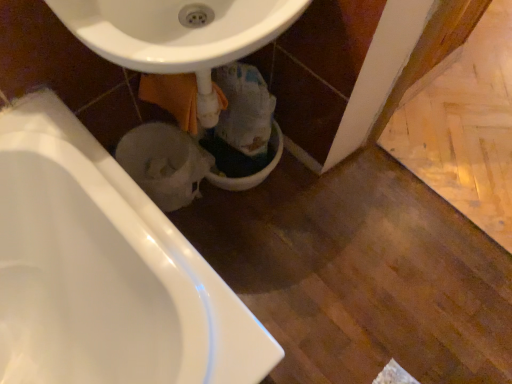
What do you see at coordinates (117, 260) in the screenshot? The image size is (512, 384). I see `white glossy bathtub at lower left` at bounding box center [117, 260].

The width and height of the screenshot is (512, 384). Identify the location of white glossy toilet bowl at center, the 2th toilet bowl viewed from the left. (253, 174).

In order to face white glossy toilet bowl at lower center, the first toilet bowl from the left, should I rotate leftwards or rightwards?

You should look left and rotate roughly 11.383 degrees.

Where is `white glossy bathtub at lower left`? The image size is (512, 384). white glossy bathtub at lower left is located at coordinates (117, 260).

Consider the image. Is white glossy bathtub at lower left not within white glossy sink at center?

Indeed, white glossy bathtub at lower left is completely outside white glossy sink at center.

Can you see white glossy bathtub at lower left touching white glossy sink at center?

There is a gap between white glossy bathtub at lower left and white glossy sink at center.

Is white glossy bathtub at lower left taller or shorter than white glossy sink at center?

white glossy bathtub at lower left is taller than white glossy sink at center.

Which is behind, point (84, 228) or point (179, 58)?

The point (84, 228) is behind.

From a real-world perspective, which object stands above the other?

white glossy sink at center is physically above.

Is white glossy sink at center positioned beyond the bounds of white glossy toilet bowl at lower center, the 2th toilet bowl from the right?

white glossy sink at center is positioned outside white glossy toilet bowl at lower center, the 2th toilet bowl from the right.

In terms of height, does white glossy sink at center look taller or shorter compared to white glossy toilet bowl at lower center, the 2th toilet bowl from the right?

Clearly, white glossy sink at center is taller compared to white glossy toilet bowl at lower center, the 2th toilet bowl from the right.

Considering the sizes of objects white glossy bathtub at lower left and white glossy toilet bowl at lower center, the 2th toilet bowl from the right, in the image provided, who is shorter, white glossy bathtub at lower left or white glossy toilet bowl at lower center, the 2th toilet bowl from the right,?

Standing shorter between the two is white glossy toilet bowl at lower center, the 2th toilet bowl from the right.

Would you consider white glossy bathtub at lower left to be distant from white glossy toilet bowl at lower center, the 2th toilet bowl from the right?

No, white glossy bathtub at lower left is not far from white glossy toilet bowl at lower center, the 2th toilet bowl from the right.

Which is more to the right, white glossy bathtub at lower left or white glossy toilet bowl at lower center, the first toilet bowl from the left?

From the viewer's perspective, white glossy toilet bowl at lower center, the first toilet bowl from the left, appears more on the right side.

Is white glossy bathtub at lower left situated inside white glossy toilet bowl at lower center, the 2th toilet bowl from the right, or outside?

white glossy bathtub at lower left is outside white glossy toilet bowl at lower center, the 2th toilet bowl from the right.

In terms of size, does white glossy toilet bowl at center, the 2th toilet bowl viewed from the left, appear bigger or smaller than white glossy bathtub at lower left?

Clearly, white glossy toilet bowl at center, the 2th toilet bowl viewed from the left, is smaller in size than white glossy bathtub at lower left.

Is white glossy toilet bowl at center, the 2th toilet bowl viewed from the left, wider or thinner than white glossy bathtub at lower left?

Considering their sizes, white glossy toilet bowl at center, the 2th toilet bowl viewed from the left, looks slimmer than white glossy bathtub at lower left.

Is white glossy toilet bowl at center, the 1th toilet bowl in the right-to-left sequence, facing away from white glossy bathtub at lower left?

No, white glossy bathtub at lower left is not at the back of white glossy toilet bowl at center, the 1th toilet bowl in the right-to-left sequence.

Is white glossy toilet bowl at center, the 1th toilet bowl in the right-to-left sequence, placed right next to white glossy bathtub at lower left?

No.

Which object is closer to the camera, white glossy toilet bowl at center, the 2th toilet bowl viewed from the left, or white glossy toilet bowl at lower center, the 2th toilet bowl from the right?

white glossy toilet bowl at lower center, the 2th toilet bowl from the right, is more forward.

I want to click on toilet bowl located in front of the white glossy toilet bowl at center, the 1th toilet bowl in the right-to-left sequence, so click(x=164, y=163).

Between point (207, 174) and point (144, 127), which one is positioned in front?

The point (144, 127) is in front.

From the image's perspective, is white glossy toilet bowl at center, the 1th toilet bowl in the right-to-left sequence, under white glossy toilet bowl at lower center, the 2th toilet bowl from the right?

No, from the image's perspective, white glossy toilet bowl at center, the 1th toilet bowl in the right-to-left sequence, is not below white glossy toilet bowl at lower center, the 2th toilet bowl from the right.

Which is more to the left, white glossy sink at center or white glossy toilet bowl at center, the 1th toilet bowl in the right-to-left sequence?

Positioned to the left is white glossy sink at center.

Does white glossy sink at center turn towards white glossy toilet bowl at center, the 1th toilet bowl in the right-to-left sequence?

No, white glossy sink at center is not turned towards white glossy toilet bowl at center, the 1th toilet bowl in the right-to-left sequence.

From the image's perspective, is white glossy sink at center above white glossy toilet bowl at center, the 1th toilet bowl in the right-to-left sequence?

Yes, from the image's perspective, white glossy sink at center is above white glossy toilet bowl at center, the 1th toilet bowl in the right-to-left sequence.

Visually, is white glossy sink at center positioned to the left or to the right of white glossy bathtub at lower left?

Clearly, white glossy sink at center is on the right of white glossy bathtub at lower left in the image.

Find the location of a particular element. The height and width of the screenshot is (384, 512). sink above the white glossy bathtub at lower left (from a real-world perspective) is located at coordinates (178, 35).

Is white glossy sink at center further to camera compared to white glossy bathtub at lower left?

Yes, it is.

Is white glossy sink at center turned away from white glossy bathtub at lower left?

No, white glossy sink at center's orientation is not away from white glossy bathtub at lower left.

Where is `sink above the white glossy bathtub at lower left (from the image's perspective)`? The height and width of the screenshot is (384, 512). sink above the white glossy bathtub at lower left (from the image's perspective) is located at coordinates (178, 35).

At what (x,y) coordinates should I click in order to perform the action: click on sink located in front of the white glossy toilet bowl at lower center, the first toilet bowl from the left. Please return your answer as a coordinate pair (x, y). The height and width of the screenshot is (384, 512). Looking at the image, I should click on (178, 35).

Based on their spatial positions, is white glossy bathtub at lower left or white glossy toilet bowl at center, the 1th toilet bowl in the right-to-left sequence, further from white glossy sink at center?

Based on the image, white glossy toilet bowl at center, the 1th toilet bowl in the right-to-left sequence, appears to be further to white glossy sink at center.

Based on the photo, based on their spatial positions, is white glossy toilet bowl at center, the 1th toilet bowl in the right-to-left sequence, or white glossy bathtub at lower left closer to white glossy toilet bowl at lower center, the first toilet bowl from the left?

The object closer to white glossy toilet bowl at lower center, the first toilet bowl from the left, is white glossy toilet bowl at center, the 1th toilet bowl in the right-to-left sequence.

Based on their spatial positions, is white glossy bathtub at lower left or white glossy sink at center further from white glossy toilet bowl at lower center, the 2th toilet bowl from the right?

Among the two, white glossy bathtub at lower left is located further to white glossy toilet bowl at lower center, the 2th toilet bowl from the right.

From the image, which object appears to be farther from white glossy sink at center, white glossy bathtub at lower left or white glossy toilet bowl at lower center, the 2th toilet bowl from the right?

Based on the image, white glossy toilet bowl at lower center, the 2th toilet bowl from the right, appears to be further to white glossy sink at center.

Which object lies further to the anchor point white glossy bathtub at lower left, white glossy toilet bowl at lower center, the 2th toilet bowl from the right, or white glossy toilet bowl at center, the 1th toilet bowl in the right-to-left sequence?

Among the two, white glossy toilet bowl at center, the 1th toilet bowl in the right-to-left sequence, is located further to white glossy bathtub at lower left.

Based on their spatial positions, is white glossy toilet bowl at center, the 2th toilet bowl viewed from the left, or white glossy toilet bowl at lower center, the first toilet bowl from the left, closer to white glossy sink at center?

Based on the image, white glossy toilet bowl at lower center, the first toilet bowl from the left, appears to be nearer to white glossy sink at center.

Estimate the real-world distances between objects in this image. Which object is closer to white glossy toilet bowl at center, the 1th toilet bowl in the right-to-left sequence, white glossy toilet bowl at lower center, the 2th toilet bowl from the right, or white glossy bathtub at lower left?

white glossy toilet bowl at lower center, the 2th toilet bowl from the right.

Considering their positions, is white glossy toilet bowl at center, the 2th toilet bowl viewed from the left, positioned further to white glossy bathtub at lower left than white glossy sink at center?

Based on the image, white glossy toilet bowl at center, the 2th toilet bowl viewed from the left, appears to be further to white glossy bathtub at lower left.

Identify the location of toilet bowl between white glossy sink at center and white glossy toilet bowl at center, the 1th toilet bowl in the right-to-left sequence, from front to back. This screenshot has width=512, height=384. (164, 163).

I want to click on sink located between white glossy bathtub at lower left and white glossy toilet bowl at center, the 1th toilet bowl in the right-to-left sequence, in the depth direction, so click(178, 35).

The height and width of the screenshot is (384, 512). In order to click on toilet bowl positioned between white glossy bathtub at lower left and white glossy toilet bowl at center, the 2th toilet bowl viewed from the left, from near to far in this screenshot , I will do `click(164, 163)`.

Locate an element on the screen. The image size is (512, 384). sink between white glossy bathtub at lower left and white glossy toilet bowl at lower center, the 2th toilet bowl from the right, along the z-axis is located at coordinates (178, 35).